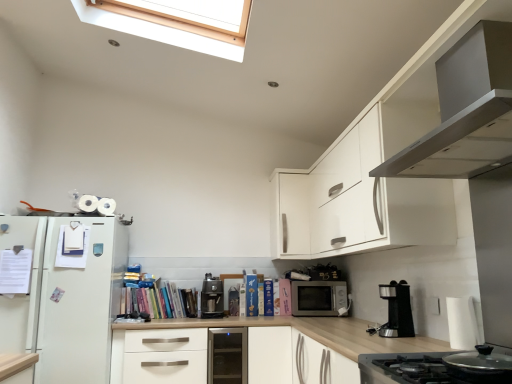
Locate an element on the screen. hardcover books at center is located at coordinates (159, 300).

Describe the element at coordinates (396, 311) in the screenshot. The image size is (512, 384). I see `black plastic coffee machine at lower right, the 1th coffee machine in the right-to-left sequence` at that location.

Identify the location of satin silver range hood at upper right, which is the second home appliance from bottom to top. The height and width of the screenshot is (384, 512). tap(465, 110).

Where is `matte silver microwave at center`? The width and height of the screenshot is (512, 384). matte silver microwave at center is located at coordinates (318, 298).

The image size is (512, 384). Find the location of `satin black coffee machine at center, the first coffee machine in the back-to-front sequence`. satin black coffee machine at center, the first coffee machine in the back-to-front sequence is located at coordinates (211, 298).

Which is farther from the camera, [310,314] or [152,339]?

The point [310,314] is farther from the camera.

Is matte silver microwave at center positioned beyond the bounds of white matte drawer at center?

That's correct, matte silver microwave at center is outside of white matte drawer at center.

Which of these two, matte silver microwave at center or white matte drawer at center, is smaller?

matte silver microwave at center is smaller.

Does matte silver microwave at center touch white matte drawer at center?

No, matte silver microwave at center is not in contact with white matte drawer at center.

How many degrees apart are the facing directions of hardcover books at center and satin black coffee machine at center, the first coffee machine in the left-to-right sequence?

They differ by 2.2 degrees in their facing directions.

Which is behind, point (176, 311) or point (214, 294)?

The point (214, 294) is behind.

Is hardcover books at center facing towards satin black coffee machine at center, the first coffee machine in the back-to-front sequence?

No, hardcover books at center is not oriented towards satin black coffee machine at center, the first coffee machine in the back-to-front sequence.

Considering the relative positions of hardcover books at center and satin black coffee machine at center, the first coffee machine in the left-to-right sequence, in the image provided, is hardcover books at center to the right of satin black coffee machine at center, the first coffee machine in the left-to-right sequence, from the viewer's perspective?

Incorrect, hardcover books at center is not on the right side of satin black coffee machine at center, the first coffee machine in the left-to-right sequence.

Can you confirm if satin black coffee machine at center, which is the 2th coffee machine in front-to-back order, is wider than stainless steel stove at lower right, marked as the second home appliance in a top-to-bottom arrangement?

No, satin black coffee machine at center, which is the 2th coffee machine in front-to-back order, is not wider than stainless steel stove at lower right, marked as the second home appliance in a top-to-bottom arrangement.

There is a satin black coffee machine at center, which is the 2th coffee machine in front-to-back order. At what (x,y) coordinates should I click in order to perform the action: click on the 1st home appliance above it (from the image's perspective). Please return your answer as a coordinate pair (x, y). This screenshot has height=384, width=512. Looking at the image, I should click on (419, 370).

Consider the image. From the image's perspective, is satin black coffee machine at center, which is the 2th coffee machine in front-to-back order, positioned above or below stainless steel stove at lower right, which appears as the 1th home appliance when ordered from the bottom?

From the image's perspective, satin black coffee machine at center, which is the 2th coffee machine in front-to-back order, appears below stainless steel stove at lower right, which appears as the 1th home appliance when ordered from the bottom.

Could you tell me if satin black coffee machine at center, which is the 2th coffee machine in front-to-back order, is turned towards stainless steel stove at lower right, which appears as the 1th home appliance when ordered from the bottom?

Yes, satin black coffee machine at center, which is the 2th coffee machine in front-to-back order, is turned towards stainless steel stove at lower right, which appears as the 1th home appliance when ordered from the bottom.

At what (x,y) coordinates should I click in order to perform the action: click on drawer to the left of satin black coffee machine at center, which is the 2th coffee machine in front-to-back order. Please return your answer as a coordinate pair (x, y). The image size is (512, 384). Looking at the image, I should click on (165, 356).

Does white matte drawer at center have a lesser height compared to satin black coffee machine at center, the first coffee machine in the back-to-front sequence?

In fact, white matte drawer at center may be taller than satin black coffee machine at center, the first coffee machine in the back-to-front sequence.

From the image's perspective, who appears lower, white matte drawer at center or satin black coffee machine at center, which is the 2th coffee machine in front-to-back order?

white matte drawer at center is shown below in the image.

Considering the relative positions of white matte drawer at center and satin black coffee machine at center, marked as the second coffee machine in a right-to-left arrangement, in the image provided, is white matte drawer at center to the right of satin black coffee machine at center, marked as the second coffee machine in a right-to-left arrangement, from the viewer's perspective?

No.

Considering the sizes of matte silver microwave at center and satin black coffee machine at center, marked as the second coffee machine in a right-to-left arrangement, in the image, is matte silver microwave at center bigger or smaller than satin black coffee machine at center, marked as the second coffee machine in a right-to-left arrangement,?

matte silver microwave at center is bigger than satin black coffee machine at center, marked as the second coffee machine in a right-to-left arrangement.

From a real-world perspective, who is located lower, matte silver microwave at center or satin black coffee machine at center, marked as the second coffee machine in a right-to-left arrangement?

matte silver microwave at center.

From the image's perspective, which one is positioned lower, matte silver microwave at center or satin black coffee machine at center, marked as the second coffee machine in a right-to-left arrangement?

matte silver microwave at center is shown below in the image.

Could you tell me if matte silver microwave at center is facing satin black coffee machine at center, which is the 2th coffee machine in front-to-back order?

No.

Who is shorter, satin silver range hood at upper right, which is the 1th home appliance from top to bottom, or black plastic coffee machine at lower right, which is the 2th coffee machine in back-to-front order?

With less height is black plastic coffee machine at lower right, which is the 2th coffee machine in back-to-front order.

How different are the orientations of satin silver range hood at upper right, which is the 1th home appliance from top to bottom, and black plastic coffee machine at lower right, the 1th coffee machine in the right-to-left sequence, in degrees?

The facing directions of satin silver range hood at upper right, which is the 1th home appliance from top to bottom, and black plastic coffee machine at lower right, the 1th coffee machine in the right-to-left sequence, are 2.51 degrees apart.

From the image's perspective, who appears lower, satin silver range hood at upper right, which is the second home appliance from bottom to top, or black plastic coffee machine at lower right, which is the 2th coffee machine in back-to-front order?

black plastic coffee machine at lower right, which is the 2th coffee machine in back-to-front order, is shown below in the image.

Is point (233, 360) closer to viewer compared to point (483, 76)?

No.

The height and width of the screenshot is (384, 512). In order to click on the 2nd home appliance above the satin silver dishwasher at center (from the image's perspective) in this screenshot , I will do `click(465, 110)`.

Is satin silver dishwasher at center not near satin silver range hood at upper right, which is the 1th home appliance from top to bottom?

satin silver dishwasher at center is far away from satin silver range hood at upper right, which is the 1th home appliance from top to bottom.

Does satin silver dishwasher at center have a lesser width compared to satin silver range hood at upper right, which is the 1th home appliance from top to bottom?

In fact, satin silver dishwasher at center might be wider than satin silver range hood at upper right, which is the 1th home appliance from top to bottom.

Locate an element on the screen. drawer below the matte silver microwave at center (from a real-world perspective) is located at coordinates point(165,356).

Locate an element on the screen. The image size is (512, 384). book behind the satin black coffee machine at center, marked as the second coffee machine in a right-to-left arrangement is located at coordinates (159, 300).

Looking at the image, which one is located further to satin black coffee machine at center, which is the 2th coffee machine in front-to-back order, black plastic coffee machine at lower right, which is the 2th coffee machine in back-to-front order, or matte silver microwave at center?

The object further to satin black coffee machine at center, which is the 2th coffee machine in front-to-back order, is black plastic coffee machine at lower right, which is the 2th coffee machine in back-to-front order.

Looking at the image, which one is located closer to white matte drawer at center, stainless steel stove at lower right, which appears as the 1th home appliance when ordered from the bottom, or satin silver dishwasher at center?

satin silver dishwasher at center is positioned closer to the anchor white matte drawer at center.

Considering their positions, is hardcover books at center positioned closer to satin black coffee machine at center, the first coffee machine in the back-to-front sequence, than black plastic coffee machine at lower right, which is the 2th coffee machine in back-to-front order?

Among the two, hardcover books at center is located nearer to satin black coffee machine at center, the first coffee machine in the back-to-front sequence.

Based on their spatial positions, is black plastic coffee machine at lower right, positioned as the first coffee machine in front-to-back order, or satin black coffee machine at center, the first coffee machine in the back-to-front sequence, closer to stainless steel stove at lower right, which appears as the 1th home appliance when ordered from the bottom?

Among the two, black plastic coffee machine at lower right, positioned as the first coffee machine in front-to-back order, is located nearer to stainless steel stove at lower right, which appears as the 1th home appliance when ordered from the bottom.

Based on their spatial positions, is black plastic coffee machine at lower right, positioned as the first coffee machine in front-to-back order, or satin black coffee machine at center, marked as the second coffee machine in a right-to-left arrangement, closer to satin silver range hood at upper right, which is the second home appliance from bottom to top?

black plastic coffee machine at lower right, positioned as the first coffee machine in front-to-back order.

Based on their spatial positions, is hardcover books at center or black plastic coffee machine at lower right, the 1th coffee machine in the right-to-left sequence, further from matte silver microwave at center?

Based on the image, black plastic coffee machine at lower right, the 1th coffee machine in the right-to-left sequence, appears to be further to matte silver microwave at center.

From the image, which object appears to be nearer to black plastic coffee machine at lower right, positioned as the first coffee machine in front-to-back order, satin black coffee machine at center, which is the 2th coffee machine in front-to-back order, or stainless steel stove at lower right, which appears as the 1th home appliance when ordered from the bottom?

stainless steel stove at lower right, which appears as the 1th home appliance when ordered from the bottom.

Estimate the real-world distances between objects in this image. Which object is further from white matte drawer at center, satin silver range hood at upper right, which is the second home appliance from bottom to top, or satin silver dishwasher at center?

satin silver range hood at upper right, which is the second home appliance from bottom to top, is positioned further to the anchor white matte drawer at center.

Identify the location of dish washer between satin silver range hood at upper right, which is the 1th home appliance from top to bottom, and matte silver microwave at center from front to back. Image resolution: width=512 pixels, height=384 pixels. (227, 356).

Locate an element on the screen. home appliance located between stainless steel stove at lower right, marked as the second home appliance in a top-to-bottom arrangement, and satin silver dishwasher at center in the depth direction is located at coordinates (465, 110).

At what (x,y) coordinates should I click in order to perform the action: click on dish washer between hardcover books at center and matte silver microwave at center. Please return your answer as a coordinate pair (x, y). Looking at the image, I should click on (227, 356).

Locate an element on the screen. The height and width of the screenshot is (384, 512). drawer located between stainless steel stove at lower right, marked as the second home appliance in a top-to-bottom arrangement, and satin silver dishwasher at center in the depth direction is located at coordinates (165, 356).